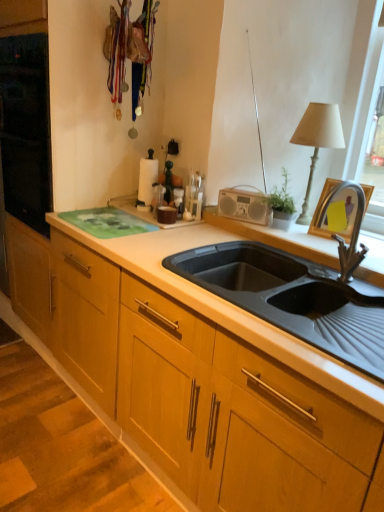
Question: Considering the positions of point (145, 159) and point (322, 142), is point (145, 159) closer or farther from the camera than point (322, 142)?

Choices:
 (A) closer
 (B) farther

Answer: (B)

Question: From the image's perspective, relative to white fabric lampshade at upper right, is white paper towel holder at upper center above or below?

Choices:
 (A) below
 (B) above

Answer: (A)

Question: Estimate the real-world distances between objects in this image. Which object is closer to the white paper towel holder at upper center?

Choices:
 (A) black rubber sink at center
 (B) white fabric lampshade at upper right

Answer: (A)

Question: Estimate the real-world distances between objects in this image. Which object is closer to the white paper towel holder at upper center?

Choices:
 (A) black rubber sink at center
 (B) white fabric lampshade at upper right

Answer: (A)